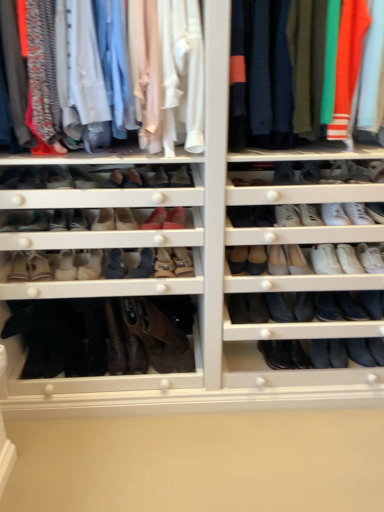
Question: Considering the relative sizes of knit sweater at upper right, the first clothing in the right-to-left sequence, and suede beige boot at center, the third shoe viewed from the left, in the image provided, is knit sweater at upper right, the first clothing in the right-to-left sequence, smaller than suede beige boot at center, the third shoe viewed from the left,?

Choices:
 (A) no
 (B) yes

Answer: (A)

Question: From a real-world perspective, is knit sweater at upper right, which is the second clothing from left to right, under suede beige boot at center, the third shoe viewed from the left?

Choices:
 (A) no
 (B) yes

Answer: (A)

Question: From a real-world perspective, is knit sweater at upper right, which is the second clothing from left to right, located higher than suede beige boot at center, arranged as the 12th shoe when viewed from the right?

Choices:
 (A) yes
 (B) no

Answer: (A)

Question: Does knit sweater at upper right, the first clothing in the right-to-left sequence, have a lesser width compared to suede beige boot at center, arranged as the 12th shoe when viewed from the right?

Choices:
 (A) yes
 (B) no

Answer: (B)

Question: Could suede beige boot at center, arranged as the 12th shoe when viewed from the right, be considered to be inside knit sweater at upper right, the first clothing in the right-to-left sequence?

Choices:
 (A) no
 (B) yes

Answer: (A)

Question: Considering the positions of point (195, 24) and point (276, 131), is point (195, 24) closer or farther from the camera than point (276, 131)?

Choices:
 (A) farther
 (B) closer

Answer: (B)

Question: Relative to knit sweater at upper right, the first clothing in the right-to-left sequence, is matte cotton shirts at upper left, which is the 1th clothing from left to right, in front or behind?

Choices:
 (A) front
 (B) behind

Answer: (A)

Question: Considering the positions of matte cotton shirts at upper left, which is the 2th clothing from right to left, and knit sweater at upper right, which is the second clothing from left to right, in the image, is matte cotton shirts at upper left, which is the 2th clothing from right to left, taller or shorter than knit sweater at upper right, which is the second clothing from left to right,?

Choices:
 (A) tall
 (B) short

Answer: (B)

Question: Considering the relative positions of matte cotton shirts at upper left, which is the 1th clothing from left to right, and knit sweater at upper right, the first clothing in the right-to-left sequence, in the image provided, is matte cotton shirts at upper left, which is the 1th clothing from left to right, to the left or to the right of knit sweater at upper right, the first clothing in the right-to-left sequence,?

Choices:
 (A) left
 (B) right

Answer: (A)

Question: Considering the positions of white leather sneaker at center right, which is the 4th shoe in right-to-left order, and matte black boot at lower left, arranged as the 14th shoe when viewed from the right, in the image, is white leather sneaker at center right, which is the 4th shoe in right-to-left order, taller or shorter than matte black boot at lower left, arranged as the 14th shoe when viewed from the right,?

Choices:
 (A) short
 (B) tall

Answer: (B)

Question: Would you say white leather sneaker at center right, which is the 4th shoe in right-to-left order, is inside or outside matte black boot at lower left, the first shoe in the left-to-right sequence?

Choices:
 (A) inside
 (B) outside

Answer: (B)

Question: Is white leather sneaker at center right, the eleventh shoe in the left-to-right sequence, wider or thinner than matte black boot at lower left, arranged as the 14th shoe when viewed from the right?

Choices:
 (A) thin
 (B) wide

Answer: (A)

Question: Relative to matte black boot at lower left, the first shoe in the left-to-right sequence, is white leather sneaker at center right, the eleventh shoe in the left-to-right sequence, in front or behind?

Choices:
 (A) behind
 (B) front

Answer: (A)

Question: From the image's perspective, relative to matte pink leather shoe at center, arranged as the 4th shoe when viewed from the left, is suede brown boot at lower left, placed as the 2th shoe when sorted from left to right, above or below?

Choices:
 (A) above
 (B) below

Answer: (B)

Question: Considering the relative positions of suede brown boot at lower left, which appears as the thirteenth shoe when viewed from the right, and matte pink leather shoe at center, marked as the eleventh shoe in a right-to-left arrangement, in the image provided, is suede brown boot at lower left, which appears as the thirteenth shoe when viewed from the right, to the left or to the right of matte pink leather shoe at center, marked as the eleventh shoe in a right-to-left arrangement,?

Choices:
 (A) right
 (B) left

Answer: (B)